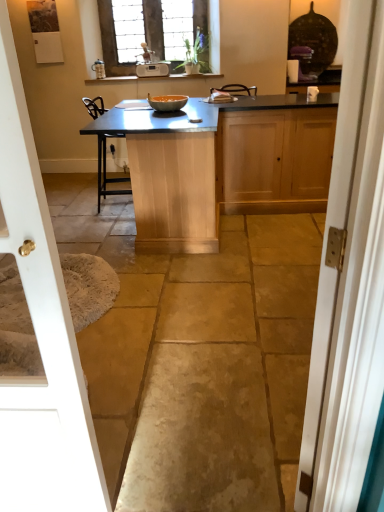
Question: Should I look upward or downward to see white painted wood door at right, arranged as the 1th door when viewed from the right?

Choices:
 (A) down
 (B) up

Answer: (A)

Question: Is stained glass window at upper center oriented towards white glossy door at left, the first door in the left-to-right sequence?

Choices:
 (A) yes
 (B) no

Answer: (A)

Question: Does stained glass window at upper center appear on the right side of white glossy door at left, placed as the second door when sorted from right to left?

Choices:
 (A) yes
 (B) no

Answer: (A)

Question: Can you confirm if stained glass window at upper center is bigger than white glossy door at left, the first door in the left-to-right sequence?

Choices:
 (A) yes
 (B) no

Answer: (A)

Question: Is white glossy door at left, the first door in the left-to-right sequence, located within stained glass window at upper center?

Choices:
 (A) no
 (B) yes

Answer: (A)

Question: Does stained glass window at upper center have a lesser height compared to white glossy door at left, placed as the second door when sorted from right to left?

Choices:
 (A) yes
 (B) no

Answer: (A)

Question: Is stained glass window at upper center smaller than white glossy door at left, placed as the second door when sorted from right to left?

Choices:
 (A) yes
 (B) no

Answer: (B)

Question: Is white painted wood door at right, arranged as the 1th door when viewed from the right, positioned with its back to white glossy door at left, placed as the second door when sorted from right to left?

Choices:
 (A) no
 (B) yes

Answer: (A)

Question: Is the depth of white painted wood door at right, arranged as the 1th door when viewed from the right, greater than that of white glossy door at left, the first door in the left-to-right sequence?

Choices:
 (A) no
 (B) yes

Answer: (A)

Question: Is white painted wood door at right, which is the 2th door from left to right, taller than white glossy door at left, placed as the second door when sorted from right to left?

Choices:
 (A) yes
 (B) no

Answer: (B)

Question: Is white painted wood door at right, which is the 2th door from left to right, outside of white glossy door at left, placed as the second door when sorted from right to left?

Choices:
 (A) yes
 (B) no

Answer: (A)

Question: Can you confirm if white painted wood door at right, which is the 2th door from left to right, is bigger than white glossy door at left, placed as the second door when sorted from right to left?

Choices:
 (A) yes
 (B) no

Answer: (A)

Question: Can you confirm if white painted wood door at right, arranged as the 1th door when viewed from the right, is smaller than white glossy door at left, placed as the second door when sorted from right to left?

Choices:
 (A) yes
 (B) no

Answer: (B)

Question: Could you tell me if white plastic radio at upper center is turned towards translucent glass bowl at center?

Choices:
 (A) no
 (B) yes

Answer: (B)